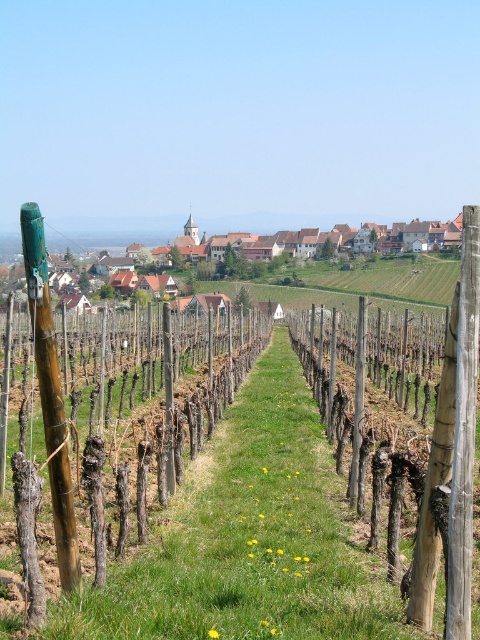
Between wooden post at center and green bamboo pole at left, which one has more height?

With more height is green bamboo pole at left.

Is point (472, 333) positioned in front of point (56, 465)?

That is True.

Image resolution: width=480 pixels, height=640 pixels. What are the coordinates of `wooden post at center` in the screenshot? It's located at (464, 433).

Is the position of wooden post at center less distant than that of brown wooden houses at center?

Yes, it is.

Does wooden post at center have a greater height compared to brown wooden houses at center?

No.

Between point (476, 323) and point (455, 266), which one is positioned behind?

The point (455, 266) is more distant.

The width and height of the screenshot is (480, 640). In order to click on wooden post at center in this screenshot , I will do `click(464, 433)`.

Who is higher up, green bamboo pole at left or brown wooden houses at center?

brown wooden houses at center is higher up.

Is green bamboo pole at left thinner than brown wooden houses at center?

Yes, green bamboo pole at left is thinner than brown wooden houses at center.

Is point (46, 445) closer to camera compared to point (406, 291)?

Yes, it is in front of point (406, 291).

The height and width of the screenshot is (640, 480). Find the location of `green bamboo pole at left`. green bamboo pole at left is located at coordinates (49, 396).